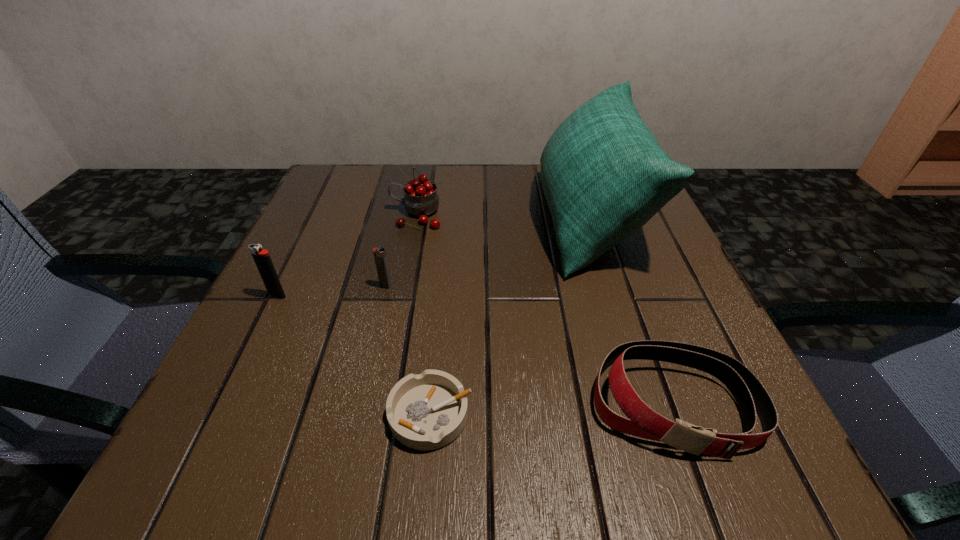
Where is `free space at the right edge`? free space at the right edge is located at coordinates (607, 275).

In the image, there is a desktop. Identify the location of vacant area at the far left corner. (370, 185).

Find the location of a particular element. This screenshot has width=960, height=540. vacant space at the near right corner is located at coordinates (680, 452).

Find the location of a particular element. free space between the second shortest object and the right igniter is located at coordinates (530, 345).

Where is `vacant space that's between the cherry and the ashtray`? The image size is (960, 540). vacant space that's between the cherry and the ashtray is located at coordinates (423, 315).

Find the location of a particular element. This screenshot has width=960, height=540. free spot between the right igniter and the fifth tallest object is located at coordinates (530, 345).

The width and height of the screenshot is (960, 540). Identify the location of vacant point located between the fifth tallest object and the leftmost object. (475, 349).

At what (x,y) coordinates should I click in order to perform the action: click on vacant region between the fourth nearest object and the cushion. Please return your answer as a coordinate pair (x, y). Looking at the image, I should click on (488, 252).

The width and height of the screenshot is (960, 540). What are the coordinates of `empty space that is in between the cherry and the ashtray` in the screenshot? It's located at (423, 315).

Locate an element on the screen. The image size is (960, 540). vacant area that lies between the cushion and the cherry is located at coordinates (503, 217).